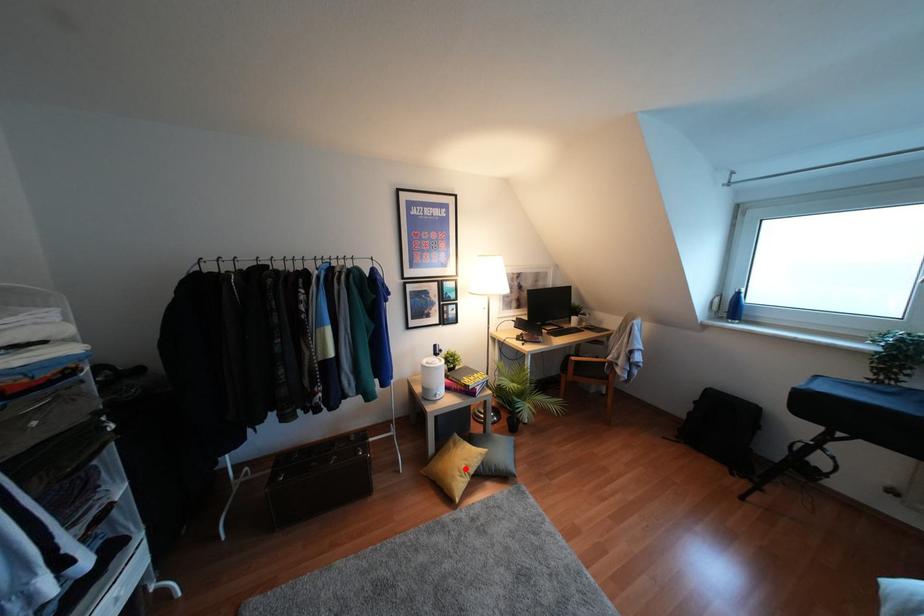
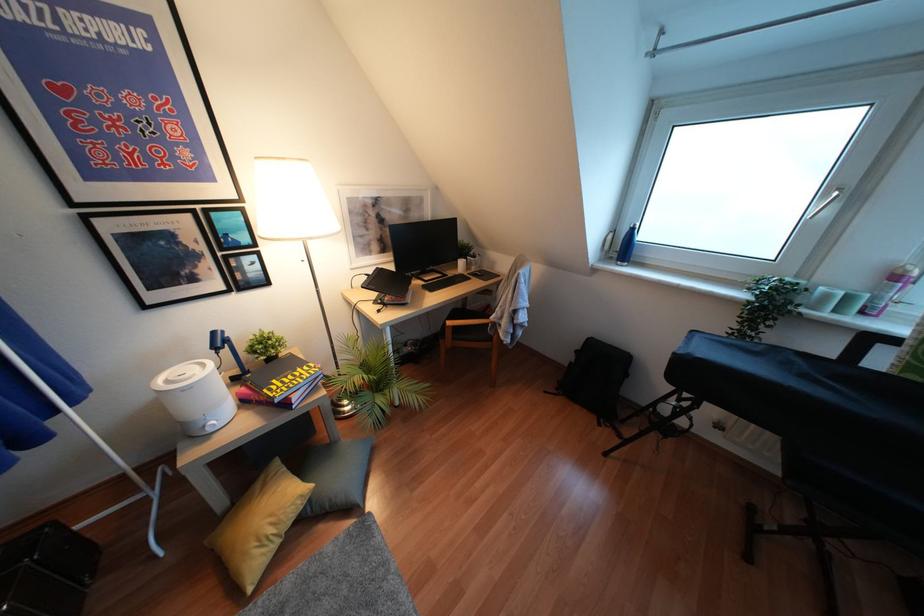
Where in the second image is the point corresponding to the highlighted location from the first image?

(271, 530)